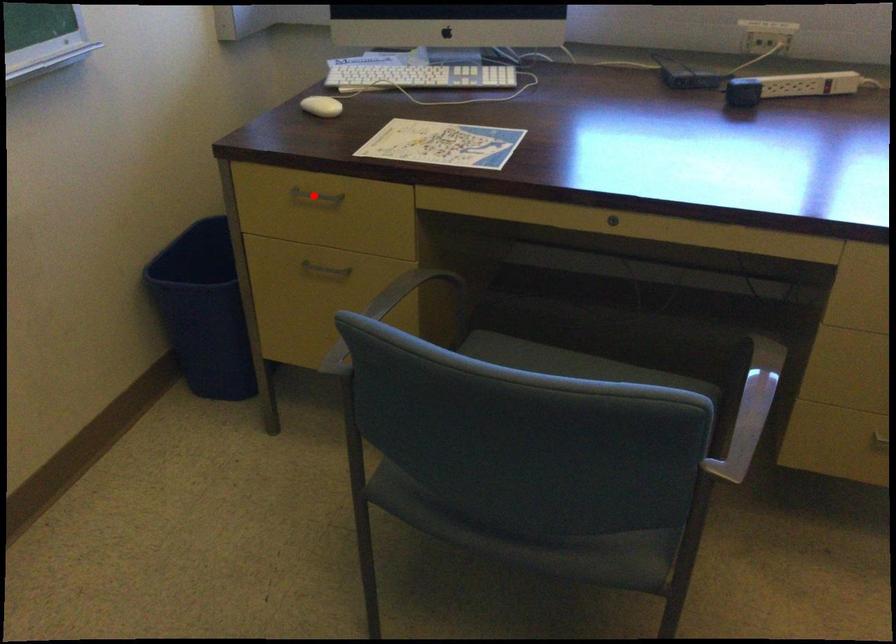
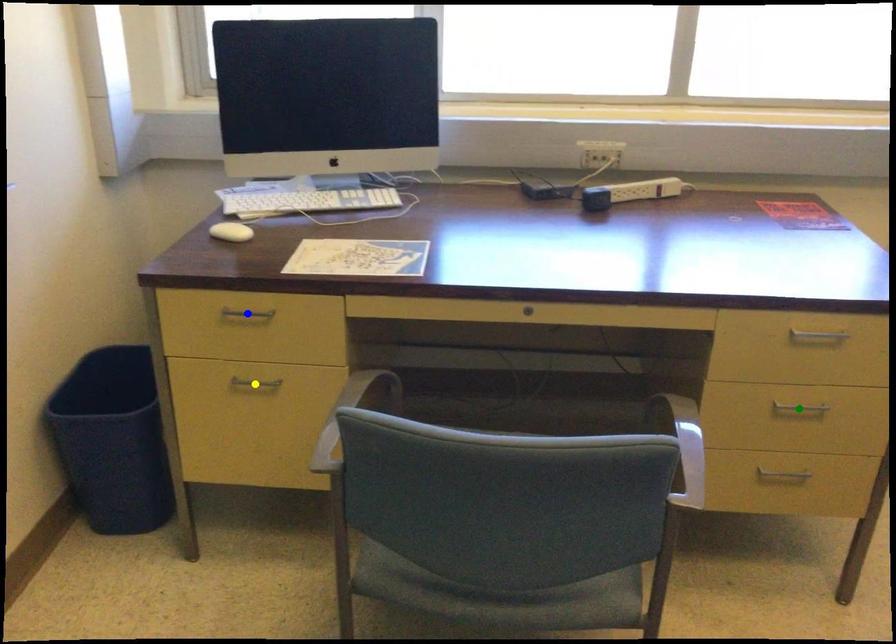
Question: I am providing you with two images of the same scene from different viewpoints. A red point is marked on the first image. You are given multiple points on the second image. Which point in image 2 represents the same 3d spot as the red point in image 1?

Choices:
 (A) yellow point
 (B) blue point
 (C) green point

Answer: (B)